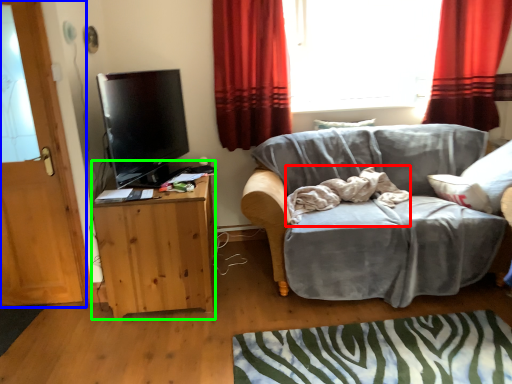
Question: Considering the real-world distances, which object is farthest from bedding (highlighted by a red box)? door (highlighted by a blue box) or cabinetry (highlighted by a green box)?

Choices:
 (A) door
 (B) cabinetry

Answer: (A)